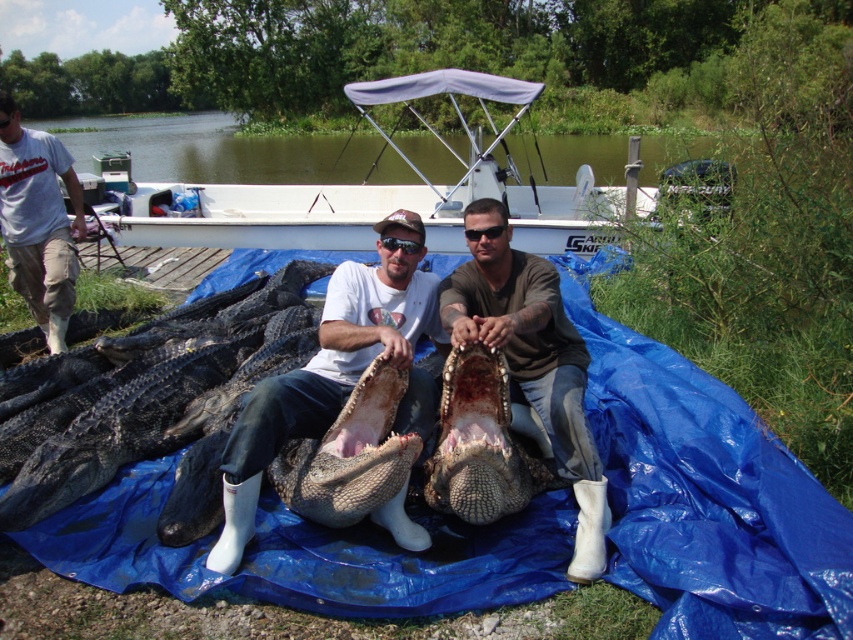
You are a wildlife photographer aiming to capture a closeup shot of the dark scaly crocodile at center without getting too close to the brown leather boots at center. Based on their sizes, which object should you focus on to ensure safety?

The dark scaly crocodile at center is larger than the brown leather boots at center, so focusing on the dark scaly crocodile at center would keep you at a safer distance from the brown leather boots at center.